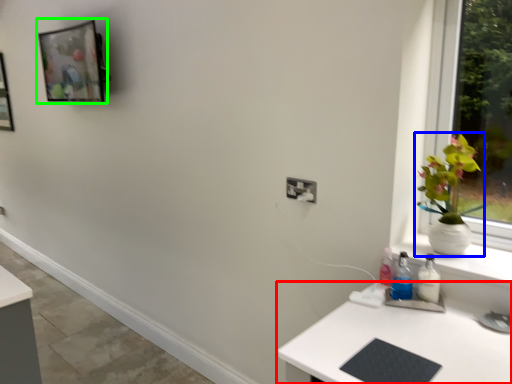
Question: Which object is positioned closest to desk (highlighted by a red box)? Select from houseplant (highlighted by a blue box) and picture frame (highlighted by a green box).

Choices:
 (A) houseplant
 (B) picture frame

Answer: (A)